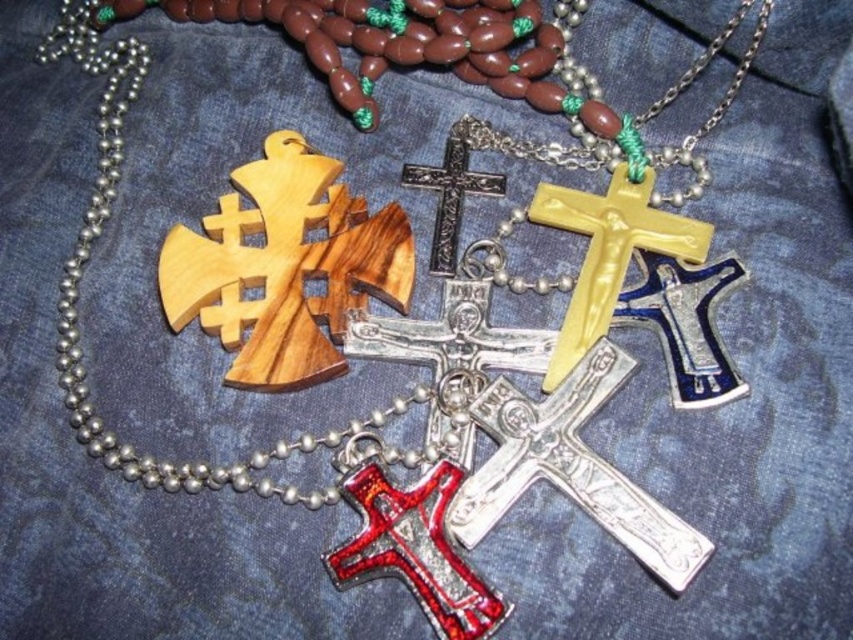
Between shiny red cross at center and yellow glossy crucifix at center, which one appears on the right side from the viewer's perspective?

yellow glossy crucifix at center is more to the right.

Can you confirm if shiny red cross at center is smaller than yellow glossy crucifix at center?

Yes.

Measure the distance between shiny red cross at center and camera.

1.17 meters

Locate an element on the screen. The height and width of the screenshot is (640, 853). shiny red cross at center is located at coordinates (415, 548).

How far apart are silver metallic cross at center and metallic silver cross at center?

They are 12.06 inches apart.

Does point (547, 468) come farther from viewer compared to point (450, 253)?

No.

This screenshot has width=853, height=640. I want to click on silver metallic cross at center, so click(x=570, y=468).

Is yellow glossy crucifix at center positioned at the back of metallic silver cross at center?

That is False.

Is yellow glossy crucifix at center wider than metallic silver cross at center?

Indeed, yellow glossy crucifix at center has a greater width compared to metallic silver cross at center.

The width and height of the screenshot is (853, 640). Find the location of `yellow glossy crucifix at center`. yellow glossy crucifix at center is located at coordinates (608, 253).